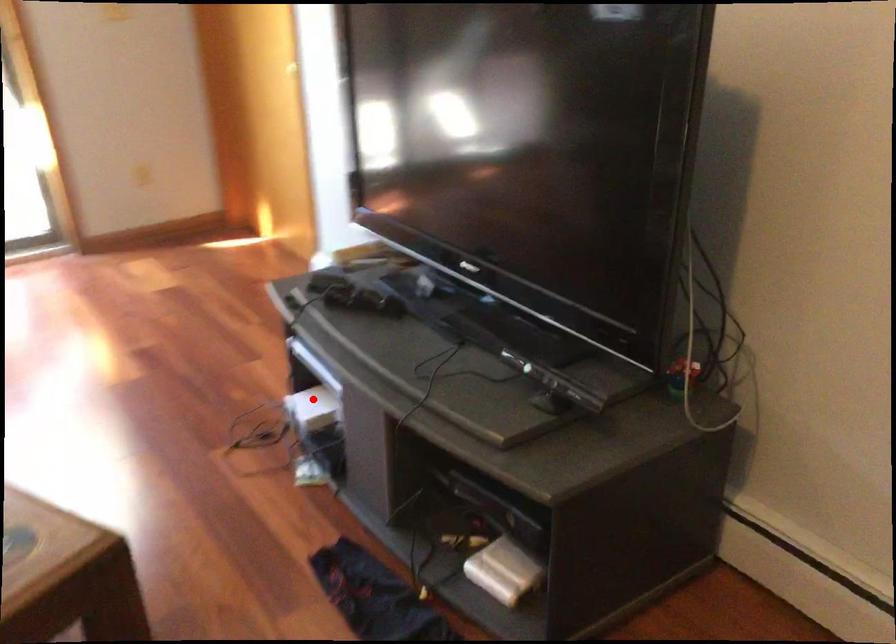
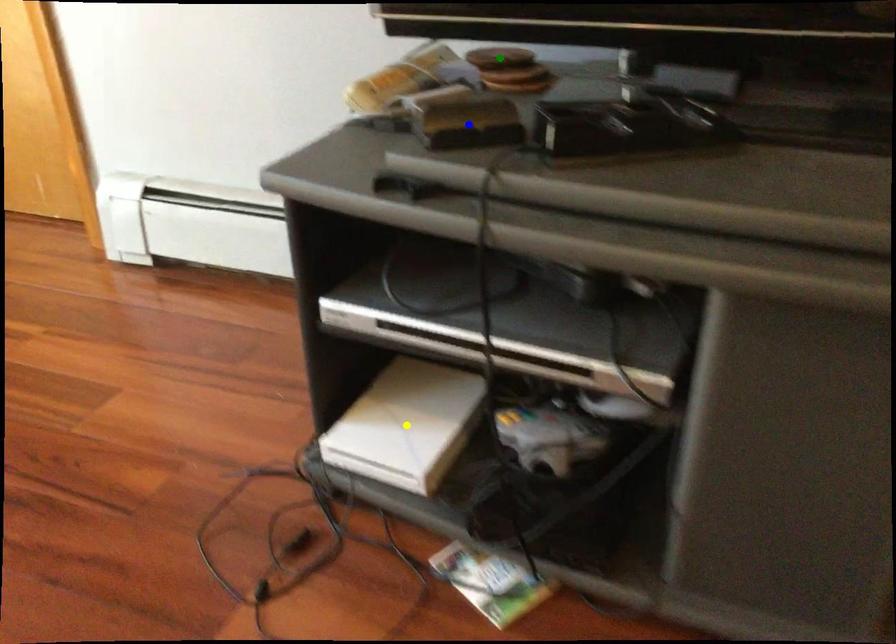
Question: I am providing you with two images of the same scene from different viewpoints. A red point is marked on the first image. You are given multiple points on the second image. Which spot in image 2 lines up with the point in image 1?

Choices:
 (A) blue point
 (B) green point
 (C) yellow point

Answer: (C)